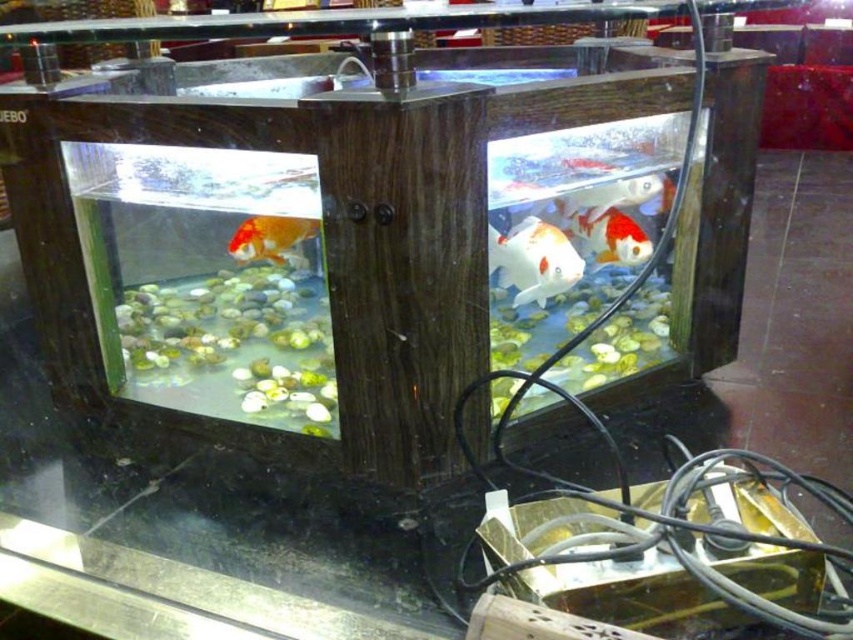
Question: Is shiny orange and white fish at upper right smaller than shiny orange and white fish at right?

Choices:
 (A) yes
 (B) no

Answer: (B)

Question: Which object is the closest to the shiny orange and white fish at right?

Choices:
 (A) shiny orange and white fish at upper right
 (B) shiny orange and white fish at center right
 (C) white glossy fish at center

Answer: (A)

Question: Observing the image, what is the correct spatial positioning of shiny orange and white fish at upper right in reference to shiny orange and white fish at right?

Choices:
 (A) above
 (B) below

Answer: (B)

Question: Can you confirm if shiny orange and white fish at center right is bigger than shiny orange and white fish at right?

Choices:
 (A) yes
 (B) no

Answer: (A)

Question: Among these points, which one is nearest to the camera?

Choices:
 (A) (589, 161)
 (B) (567, 212)
 (C) (616, 248)
 (D) (306, 225)

Answer: (A)

Question: Which point is farther to the camera?

Choices:
 (A) (238, 236)
 (B) (619, 218)

Answer: (A)